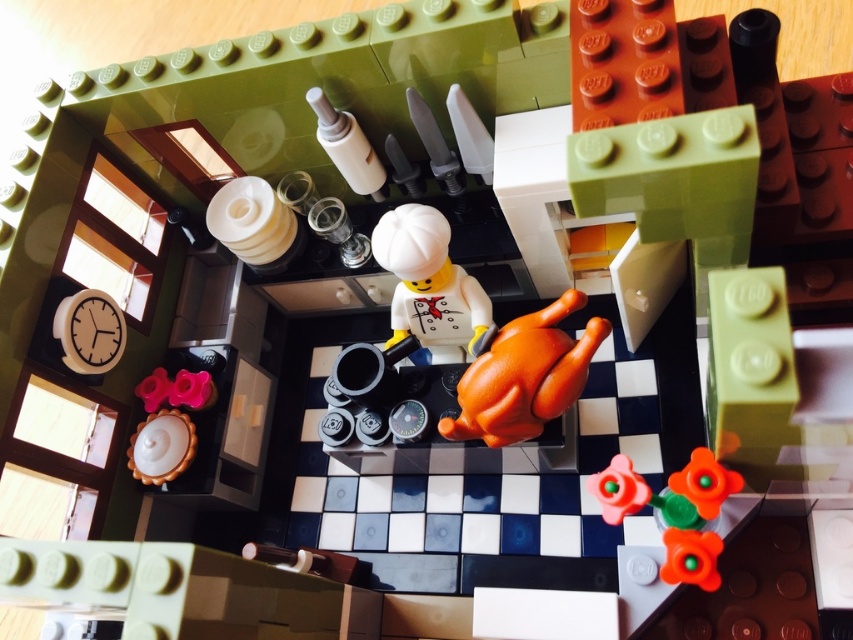
Which of these two, orange matte chicken at center or orange matte flower at lower right, stands taller?

orange matte chicken at center is taller.

Image resolution: width=853 pixels, height=640 pixels. Identify the location of orange matte chicken at center. (524, 376).

Image resolution: width=853 pixels, height=640 pixels. Find the location of `orange matte chicken at center`. orange matte chicken at center is located at coordinates tap(524, 376).

What do you see at coordinates (428, 284) in the screenshot?
I see `white matte chef hat at center` at bounding box center [428, 284].

Does white matte chef hat at center have a lesser height compared to orange matte flower at lower right?

No, white matte chef hat at center is not shorter than orange matte flower at lower right.

Locate an element on the screen. white matte chef hat at center is located at coordinates (428, 284).

Can you confirm if orange matte chicken at center is positioned below white matte chef hat at center?

Indeed, orange matte chicken at center is positioned under white matte chef hat at center.

Who is taller, orange matte chicken at center or white matte chef hat at center?

Standing taller between the two is white matte chef hat at center.

Who is more forward, (534,381) or (401,244)?

Point (534,381) is in front.

Image resolution: width=853 pixels, height=640 pixels. I want to click on orange matte chicken at center, so click(524, 376).